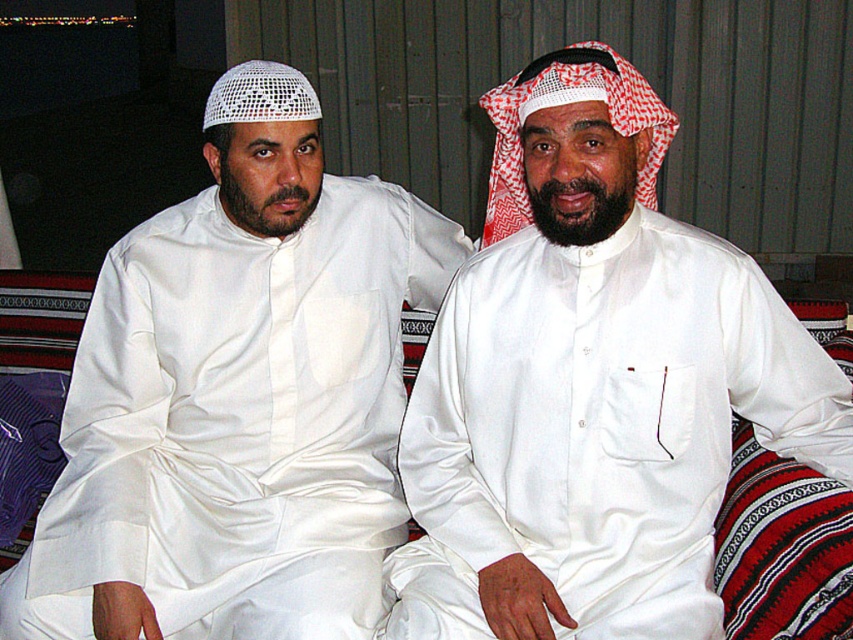
You are a fashion designer who wants to place a decorative pin on the white satin kandura at center. According to the coordinates provided, where should you place the pin to ensure it is centered horizontally and vertically on the garment?

The pin should be placed at the coordinates point (592, 385) to ensure it is centered horizontally and vertically on the white satin kandura at center.